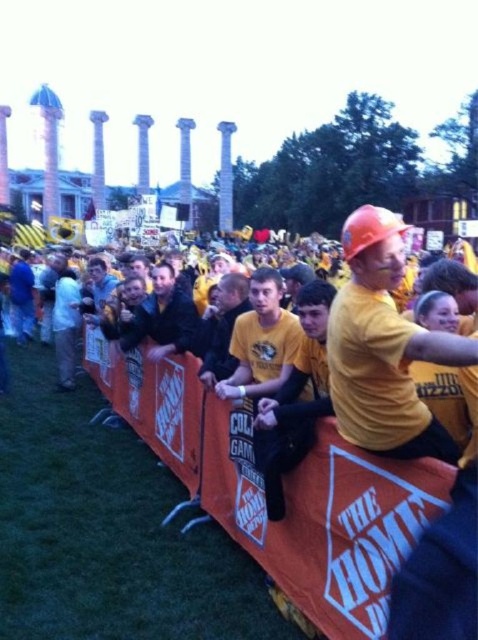
Can you confirm if orange fabric barrier at center is bigger than matte orange hard hat at center?

Yes, orange fabric barrier at center is bigger than matte orange hard hat at center.

Is orange fabric barrier at center positioned in front of matte orange hard hat at center?

Yes.

What do you see at coordinates (284, 490) in the screenshot?
I see `orange fabric barrier at center` at bounding box center [284, 490].

What are the coordinates of `orange fabric barrier at center` in the screenshot? It's located at (284, 490).